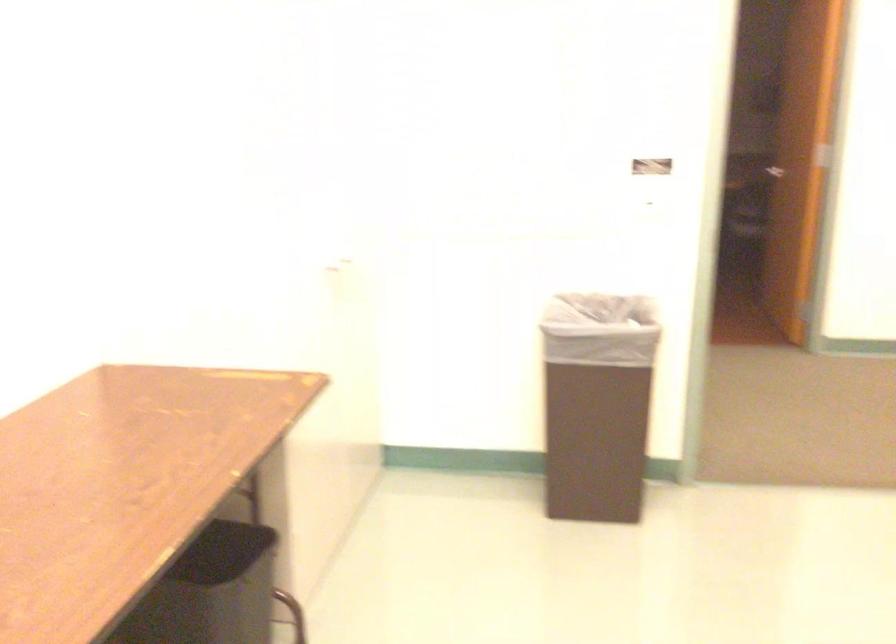
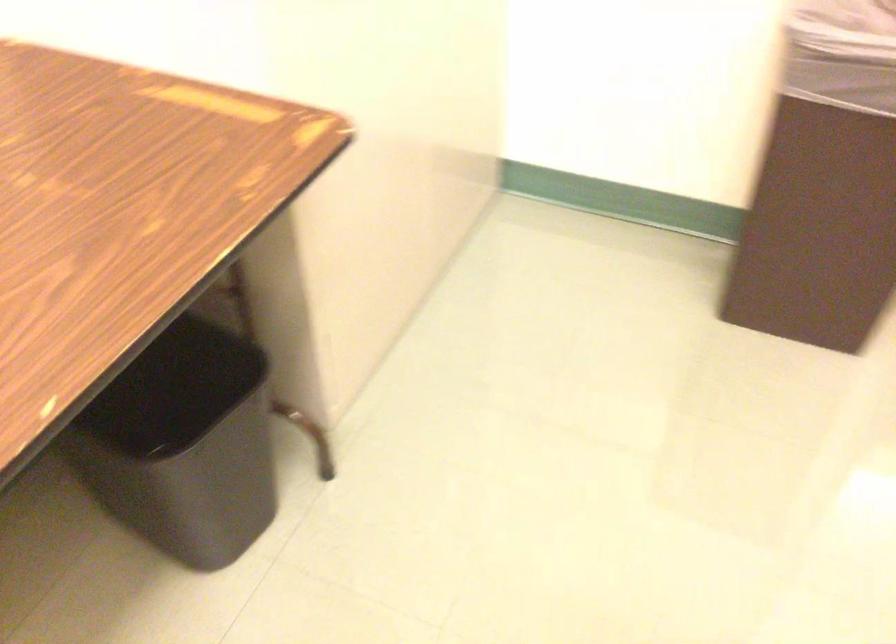
Question: The images are taken continuously from a first-person perspective. In which direction is your viewpoint rotating?

Choices:
 (A) Left
 (B) Right
 (C) Up
 (D) Down

Answer: (D)